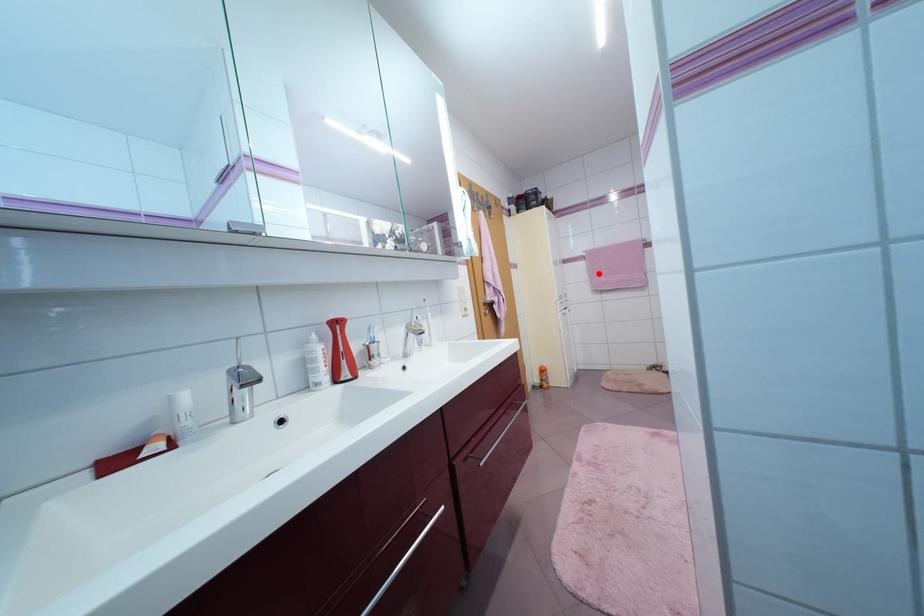
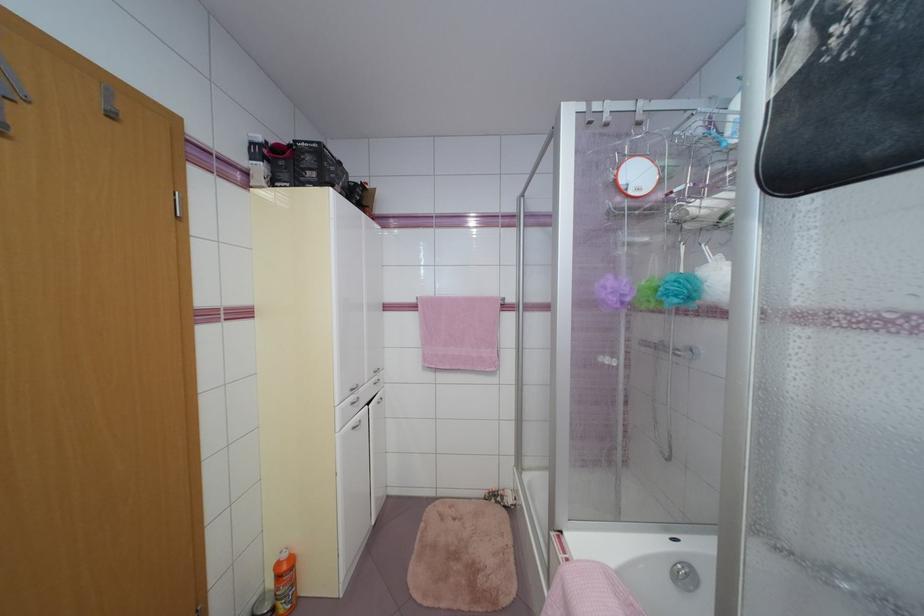
Locate, in the second image, the point that corresponds to the highlighted location in the first image.

(433, 336)